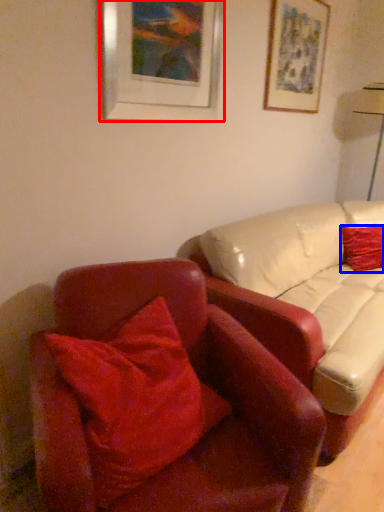
Question: Which object is closer to the camera taking this photo, picture frame (highlighted by a red box) or pillow (highlighted by a blue box)?

Choices:
 (A) picture frame
 (B) pillow

Answer: (A)